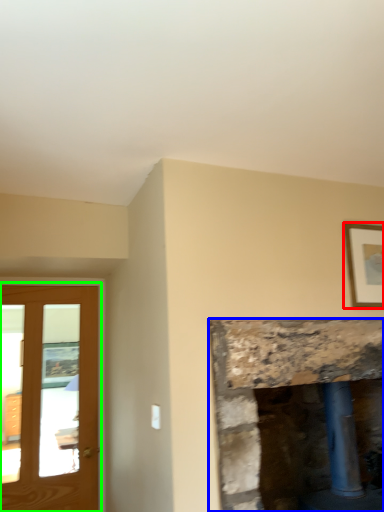
Question: Which object is positioned closest to picture frame (highlighted by a red box)? Select from fireplace (highlighted by a blue box) and screen door (highlighted by a green box).

Choices:
 (A) fireplace
 (B) screen door

Answer: (A)